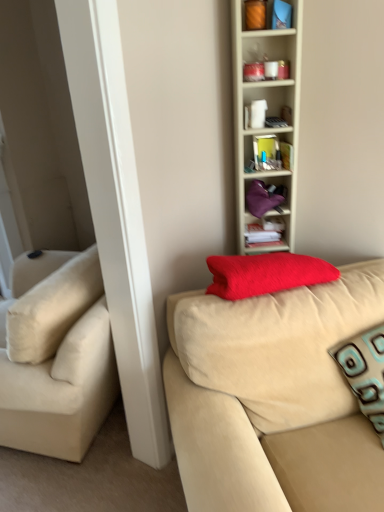
Question: In terms of size, does orange matte candle at upper center, positioned as the 1th cabinet in front-to-back order, appear bigger or smaller than velvet beige couch at center?

Choices:
 (A) small
 (B) big

Answer: (A)

Question: Would you say orange matte candle at upper center, acting as the first cabinet starting from the top, is to the left or to the right of velvet beige couch at center in the picture?

Choices:
 (A) left
 (B) right

Answer: (A)

Question: Which is nearer to the orange matte candle at upper center, positioned as the 1th cabinet in front-to-back order?

Choices:
 (A) white paper stack at upper center
 (B) wooden bookshelf at upper right
 (C) velvet beige couch at center
 (D) purple fabric bag at upper center, acting as the 1th cabinet starting from the bottom
 (E) teal patterned pillow at right

Answer: (B)

Question: Considering the real-world distances, which object is farthest from the purple fabric bag at upper center, marked as the second cabinet in a top-to-bottom arrangement?

Choices:
 (A) orange matte candle at upper center, which ranks as the second cabinet in back-to-front order
 (B) velvet beige couch at center
 (C) teal patterned pillow at right
 (D) wooden bookshelf at upper right
 (E) white paper stack at upper center

Answer: (B)